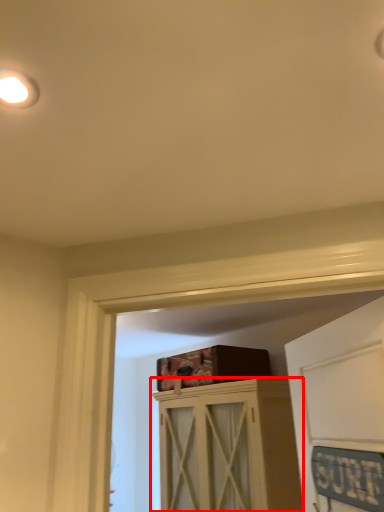
Question: Observing the image, what is the correct spatial positioning of cabinetry (annotated by the red box) in reference to droplight?

Choices:
 (A) right
 (B) left

Answer: (A)